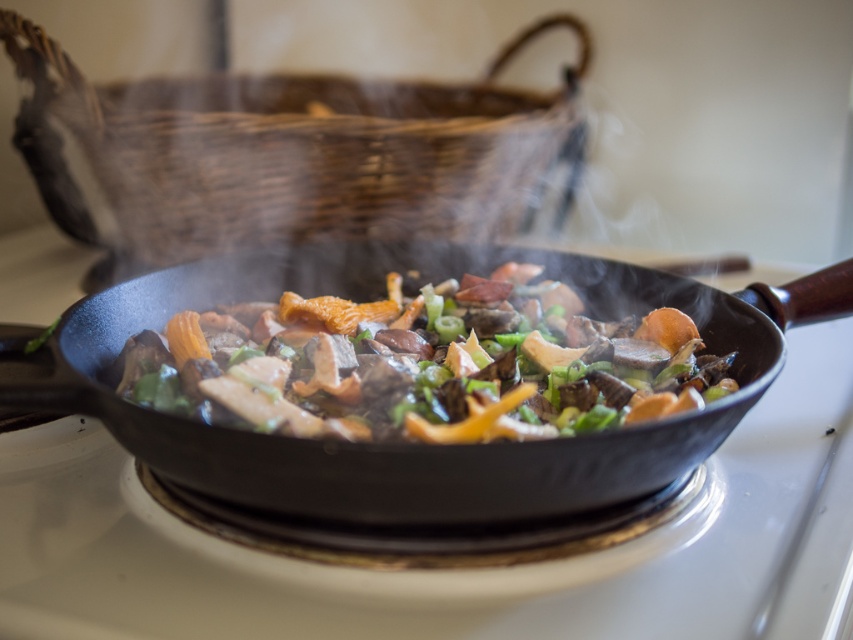
Who is lower down, woven brown basket at upper center or shiny brown pan at center?

shiny brown pan at center

Can you confirm if woven brown basket at upper center is thinner than shiny brown pan at center?

Incorrect, woven brown basket at upper center's width is not less than shiny brown pan at center's.

Describe the element at coordinates (291, 154) in the screenshot. I see `woven brown basket at upper center` at that location.

In order to click on woven brown basket at upper center in this screenshot , I will do `click(291, 154)`.

Is point (332, 228) closer to viewer compared to point (308, 477)?

No, it is not.

Can you confirm if woven brown basket at upper center is taller than shiny black pan at center?

Yes, woven brown basket at upper center is taller than shiny black pan at center.

The height and width of the screenshot is (640, 853). What do you see at coordinates (291, 154) in the screenshot?
I see `woven brown basket at upper center` at bounding box center [291, 154].

Where is `woven brown basket at upper center`? The height and width of the screenshot is (640, 853). woven brown basket at upper center is located at coordinates pos(291,154).

From the picture: Measure the distance between shiny black pan at center and shiny brown pan at center.

The distance of shiny black pan at center from shiny brown pan at center is 2.86 inches.

This screenshot has height=640, width=853. In order to click on shiny black pan at center in this screenshot , I will do `click(392, 444)`.

Between point (45, 410) and point (314, 424), which one is positioned in front?

Positioned in front is point (314, 424).

Find the location of `shiny black pan at center`. shiny black pan at center is located at coordinates (392, 444).